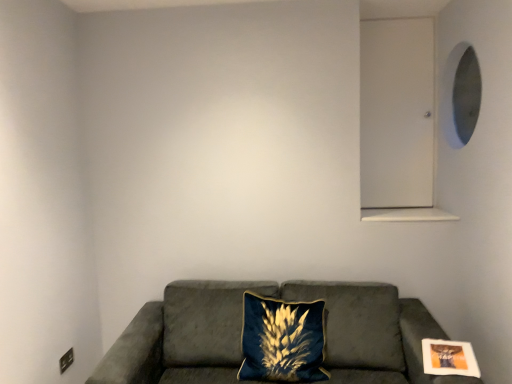
Question: Considering the relative positions of matte white picture frame at lower right and suede couch at lower center in the image provided, is matte white picture frame at lower right to the left of suede couch at lower center from the viewer's perspective?

Choices:
 (A) no
 (B) yes

Answer: (A)

Question: Does matte white picture frame at lower right have a lesser width compared to suede couch at lower center?

Choices:
 (A) no
 (B) yes

Answer: (B)

Question: Considering the relative sizes of matte white picture frame at lower right and suede couch at lower center in the image provided, is matte white picture frame at lower right bigger than suede couch at lower center?

Choices:
 (A) yes
 (B) no

Answer: (B)

Question: Would you say matte white picture frame at lower right is outside suede couch at lower center?

Choices:
 (A) no
 (B) yes

Answer: (A)

Question: Is suede couch at lower center inside matte white picture frame at lower right?

Choices:
 (A) no
 (B) yes

Answer: (A)

Question: From the image's perspective, is velvet blue pillow at center positioned above or below matte white picture frame at lower right?

Choices:
 (A) below
 (B) above

Answer: (A)

Question: Would you say velvet blue pillow at center is inside or outside matte white picture frame at lower right?

Choices:
 (A) inside
 (B) outside

Answer: (B)

Question: In terms of size, does velvet blue pillow at center appear bigger or smaller than matte white picture frame at lower right?

Choices:
 (A) small
 (B) big

Answer: (B)

Question: From a real-world perspective, is velvet blue pillow at center physically located above or below matte white picture frame at lower right?

Choices:
 (A) above
 (B) below

Answer: (B)

Question: Is matte white picture frame at lower right situated inside suede couch at lower center or outside?

Choices:
 (A) inside
 (B) outside

Answer: (A)

Question: From the image's perspective, is matte white picture frame at lower right positioned above or below suede couch at lower center?

Choices:
 (A) below
 (B) above

Answer: (B)

Question: In terms of width, does matte white picture frame at lower right look wider or thinner when compared to suede couch at lower center?

Choices:
 (A) thin
 (B) wide

Answer: (A)

Question: Would you say matte white picture frame at lower right is to the left or to the right of suede couch at lower center in the picture?

Choices:
 (A) left
 (B) right

Answer: (B)

Question: Considering their positions, is suede couch at lower center located in front of or behind velvet blue pillow at center?

Choices:
 (A) front
 (B) behind

Answer: (A)

Question: From the image's perspective, is suede couch at lower center located above or below velvet blue pillow at center?

Choices:
 (A) below
 (B) above

Answer: (A)